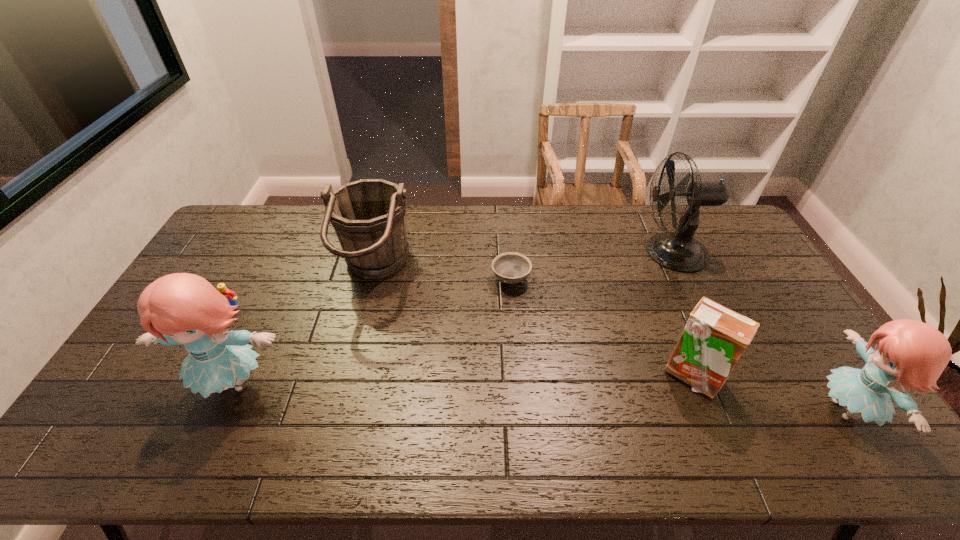
You are a GUI agent. You are given a task and a screenshot of the screen. Output one action in this format:
    pyautogui.click(x=<x>, y=<y>)
    Task: Click on the free location at the left edge of the desktop
    This screenshot has height=540, width=960.
    Given the screenshot: What is the action you would take?
    pyautogui.click(x=250, y=249)

You are a GUI agent. You are given a task and a screenshot of the screen. Output one action in this format:
    pyautogui.click(x=<x>, y=<y>)
    Task: Click on the free space at the right edge of the desktop
    The height and width of the screenshot is (540, 960).
    Given the screenshot: What is the action you would take?
    pyautogui.click(x=801, y=328)

Where is `vacant space in between the fan and the Lego`? vacant space in between the fan and the Lego is located at coordinates (451, 280).

I want to click on free space between the bowl and the fifth tallest object, so click(601, 327).

You are a GUI agent. You are given a task and a screenshot of the screen. Output one action in this format:
    pyautogui.click(x=<x>, y=<y>)
    Task: Click on the free space that is in between the bowl and the fan
    Image resolution: width=960 pixels, height=540 pixels.
    Given the screenshot: What is the action you would take?
    pyautogui.click(x=591, y=266)

Locate an element on the screen. The width and height of the screenshot is (960, 540). empty location between the right doll and the carton is located at coordinates (768, 393).

Identify the location of free space between the taller doll and the shortest object. The image size is (960, 540). (372, 331).

Image resolution: width=960 pixels, height=540 pixels. What are the coordinates of `unoccupied position between the fan and the shorter doll` in the screenshot? It's located at (758, 331).

What are the coordinates of `vacant space that is in between the sixth tallest object and the shorter doll` in the screenshot? It's located at (539, 359).

Locate an element on the screen. the fourth closest object to the third object from left to right is located at coordinates (714, 338).